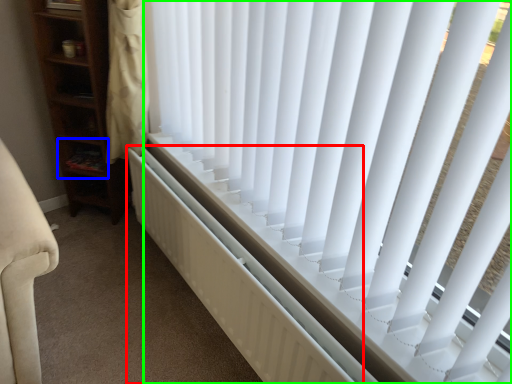
Question: Which object is the farthest from radiator (highlighted by a red box)? Choose among these: shelf (highlighted by a blue box) or window blind (highlighted by a green box).

Choices:
 (A) shelf
 (B) window blind

Answer: (A)